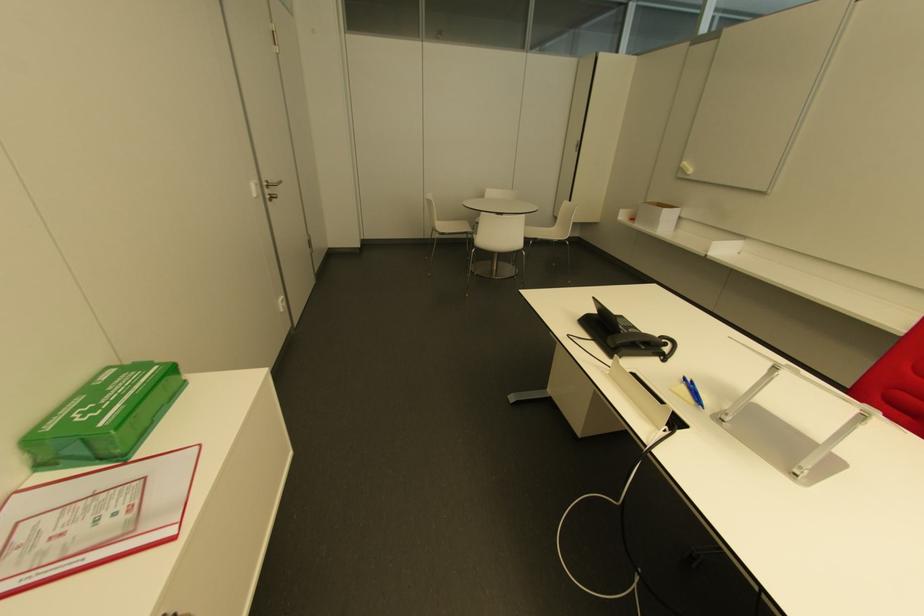
Where is `the first aid box latch`? the first aid box latch is located at coordinates [x=103, y=416].